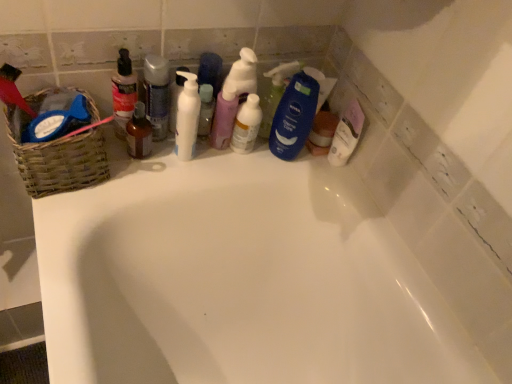
The width and height of the screenshot is (512, 384). I want to click on empty space that is to the right of translucent plastic bottle at upper left, so click(189, 165).